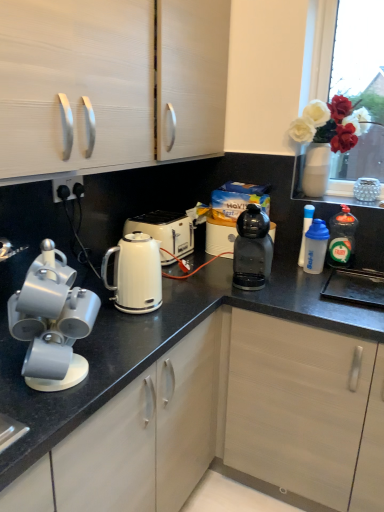
What do you see at coordinates (315, 247) in the screenshot? The height and width of the screenshot is (512, 384). I see `translucent plastic water bottle at right, which appears as the fourth kitchen appliance when viewed from the left` at bounding box center [315, 247].

The width and height of the screenshot is (384, 512). What do you see at coordinates (305, 231) in the screenshot?
I see `white plastic water bottle at right, the 3th kitchen appliance from the left` at bounding box center [305, 231].

What do you see at coordinates (66, 185) in the screenshot? The height and width of the screenshot is (512, 384). I see `black plastic socket at lower left` at bounding box center [66, 185].

Image resolution: width=384 pixels, height=512 pixels. Identify the location of white plastic toaster at upper center. (63, 192).

You are a GUI agent. You are given a task and a screenshot of the screen. Output one action in this format:
    pyautogui.click(x=<x>, y=<y>)
    Task: Click on the white glossy kettle at center
    This screenshot has width=384, height=512.
    Given the screenshot: What is the action you would take?
    pyautogui.click(x=165, y=230)

How different are the orientations of black plastic socket at lower left and translucent plastic dishwashing liquid at right, which ranks as the fifth kitchen appliance in left-to-right order, in degrees?

90 degrees.

Who is taller, black plastic socket at lower left or translucent plastic dishwashing liquid at right, which ranks as the fifth kitchen appliance in left-to-right order?

translucent plastic dishwashing liquid at right, which ranks as the fifth kitchen appliance in left-to-right order, is taller.

Is black plastic socket at lower left in contact with translucent plastic dishwashing liquid at right, the 1th kitchen appliance in the right-to-left sequence?

black plastic socket at lower left is not next to translucent plastic dishwashing liquid at right, the 1th kitchen appliance in the right-to-left sequence, and they're not touching.

Based on their positions, is black plastic socket at lower left located to the left or right of translucent plastic dishwashing liquid at right, the 1th kitchen appliance in the right-to-left sequence?

black plastic socket at lower left is positioned on translucent plastic dishwashing liquid at right, the 1th kitchen appliance in the right-to-left sequence,'s left side.

Is black plastic coffee machine at center, the second kitchen appliance viewed from the left, wider than matte gray mugs at left?

Yes, black plastic coffee machine at center, the second kitchen appliance viewed from the left, is wider than matte gray mugs at left.

Looking at this image, from a real-world perspective, between black plastic coffee machine at center, the fourth kitchen appliance when ordered from right to left, and matte gray mugs at left, who is vertically higher?

In real-world perspective, matte gray mugs at left is above.

Image resolution: width=384 pixels, height=512 pixels. In order to click on home appliance located on the left of black plastic coffee machine at center, the fourth kitchen appliance when ordered from right to left in this screenshot , I will do `click(52, 321)`.

Is black plastic coffee machine at center, the second kitchen appliance viewed from the left, in contact with matte gray mugs at left?

black plastic coffee machine at center, the second kitchen appliance viewed from the left, and matte gray mugs at left are not in contact.

Where is `the 1st kitchen appliance below when counting from the matte white cabinet at upper left (from the image's perspective)`? The height and width of the screenshot is (512, 384). the 1st kitchen appliance below when counting from the matte white cabinet at upper left (from the image's perspective) is located at coordinates (305, 231).

Considering the points (309, 208) and (52, 54), which point is in front, point (309, 208) or point (52, 54)?

Positioned in front is point (52, 54).

Can you tell me how much white plastic water bottle at right, the 3th kitchen appliance from the left, and matte white cabinet at upper left differ in facing direction?

89.5 degrees separate the facing orientations of white plastic water bottle at right, the 3th kitchen appliance from the left, and matte white cabinet at upper left.

Looking at their sizes, would you say white plastic water bottle at right, the 3th kitchen appliance from the left, is wider or thinner than matte white cabinet at upper left?

In the image, white plastic water bottle at right, the 3th kitchen appliance from the left, appears to be more narrow than matte white cabinet at upper left.

Is white plastic water bottle at right, the 3th kitchen appliance positioned from the right, shorter than white glossy electric kettle at center, marked as the fifth kitchen appliance in a right-to-left arrangement?

No, white plastic water bottle at right, the 3th kitchen appliance positioned from the right, is not shorter than white glossy electric kettle at center, marked as the fifth kitchen appliance in a right-to-left arrangement.

From a real-world perspective, count 1st kitchen appliances upward from the white glossy electric kettle at center, marked as the fifth kitchen appliance in a right-to-left arrangement, and point to it. Please provide its 2D coordinates.

[(305, 231)]

Based on the photo, between white plastic water bottle at right, the 3th kitchen appliance from the left, and white glossy electric kettle at center, marked as the fifth kitchen appliance in a right-to-left arrangement, which one appears on the left side from the viewer's perspective?

white glossy electric kettle at center, marked as the fifth kitchen appliance in a right-to-left arrangement, is more to the left.

From a real-world perspective, which is physically above, white plastic water bottle at right, the 3th kitchen appliance positioned from the right, or white glossy electric kettle at center, marked as the fifth kitchen appliance in a right-to-left arrangement?

In real-world perspective, white plastic water bottle at right, the 3th kitchen appliance positioned from the right, is above.

Who is shorter, matte white cabinet at upper left or translucent plastic dishwashing liquid at right, which ranks as the fifth kitchen appliance in left-to-right order?

translucent plastic dishwashing liquid at right, which ranks as the fifth kitchen appliance in left-to-right order.

Based on the photo, how far apart are matte white cabinet at upper left and translucent plastic dishwashing liquid at right, which ranks as the fifth kitchen appliance in left-to-right order?

matte white cabinet at upper left is 38.25 inches from translucent plastic dishwashing liquid at right, which ranks as the fifth kitchen appliance in left-to-right order.

Is the position of matte white cabinet at upper left less distant than that of translucent plastic dishwashing liquid at right, the 1th kitchen appliance in the right-to-left sequence?

Yes, it is in front of translucent plastic dishwashing liquid at right, the 1th kitchen appliance in the right-to-left sequence.

From the image's perspective, which is below, matte white cabinet at upper left or translucent plastic dishwashing liquid at right, the 1th kitchen appliance in the right-to-left sequence?

translucent plastic dishwashing liquid at right, the 1th kitchen appliance in the right-to-left sequence, from the image's perspective.

What's the angular difference between matte white cabinet at upper left and white glossy kettle at center's facing directions?

matte white cabinet at upper left and white glossy kettle at center are facing 1.35 degrees away from each other.

The width and height of the screenshot is (384, 512). In order to click on cabinetry that appears on the left of white glossy kettle at center in this screenshot , I will do `click(110, 85)`.

Is white glossy kettle at center located within matte white cabinet at upper left?

No, matte white cabinet at upper left does not contain white glossy kettle at center.

Considering the relative sizes of white plastic toaster at upper center and black plastic coffee machine at center in the image provided, is white plastic toaster at upper center thinner than black plastic coffee machine at center?

Yes, white plastic toaster at upper center is thinner than black plastic coffee machine at center.

Is white plastic toaster at upper center at the left side of black plastic coffee machine at center?

Yes, white plastic toaster at upper center is to the left of black plastic coffee machine at center.

How different are the orientations of white plastic toaster at upper center and black plastic coffee machine at center in degrees?

They differ by 87.1 degrees in their facing directions.

Is white plastic toaster at upper center not close to black plastic coffee machine at center?

No, white plastic toaster at upper center is not far away from black plastic coffee machine at center.

Identify the location of electric outlet on the left side of translucent plastic dishwashing liquid at right, the 1th kitchen appliance in the right-to-left sequence. The image size is (384, 512). (66, 185).

Identify the location of home appliance located above the black plastic coffee machine at center, the fourth kitchen appliance when ordered from right to left (from a real-world perspective). This screenshot has width=384, height=512. (52, 321).

Estimate the real-world distances between objects in this image. Which object is further from black plastic socket at lower left, matte gray mugs at left or white glossy kettle at center?

Based on the image, matte gray mugs at left appears to be further to black plastic socket at lower left.

Looking at the image, which one is located further to translucent plastic dishwashing liquid at right, which ranks as the fifth kitchen appliance in left-to-right order, black plastic coffee machine at center, the second kitchen appliance viewed from the left, or white plastic toaster at upper center?

white plastic toaster at upper center is positioned further to the anchor translucent plastic dishwashing liquid at right, which ranks as the fifth kitchen appliance in left-to-right order.

Estimate the real-world distances between objects in this image. Which object is closer to black plastic coffee machine at center, translucent plastic water bottle at right, which appears as the fourth kitchen appliance when viewed from the left, or translucent plastic dishwashing liquid at right, the 1th kitchen appliance in the right-to-left sequence?

translucent plastic water bottle at right, which appears as the fourth kitchen appliance when viewed from the left.

Looking at the image, which one is located closer to black plastic coffee machine at center, white glossy electric kettle at center, the first kitchen appliance viewed from the left, or translucent plastic dishwashing liquid at right, which ranks as the fifth kitchen appliance in left-to-right order?

Among the two, translucent plastic dishwashing liquid at right, which ranks as the fifth kitchen appliance in left-to-right order, is located nearer to black plastic coffee machine at center.

Looking at the image, which one is located further to black plastic coffee machine at center, the second kitchen appliance viewed from the left, white glossy electric kettle at center, the first kitchen appliance viewed from the left, or matte gray mugs at left?

Among the two, matte gray mugs at left is located further to black plastic coffee machine at center, the second kitchen appliance viewed from the left.

From the image, which object appears to be nearer to translucent plastic dishwashing liquid at right, the 1th kitchen appliance in the right-to-left sequence, white glossy kettle at center or translucent plastic water bottle at right, which appears as the fourth kitchen appliance when viewed from the left?

The object closer to translucent plastic dishwashing liquid at right, the 1th kitchen appliance in the right-to-left sequence, is translucent plastic water bottle at right, which appears as the fourth kitchen appliance when viewed from the left.

When comparing their distances from white glossy kettle at center, does matte white cabinet at upper left or white glossy electric kettle at center, marked as the fifth kitchen appliance in a right-to-left arrangement, seem further?

matte white cabinet at upper left.

When comparing their distances from matte white cabinet at upper left, does black plastic socket at lower left or black plastic coffee machine at center seem closer?

black plastic socket at lower left lies closer to matte white cabinet at upper left than the other object.

Locate an element on the screen. kettle positioned between matte gray mugs at left and black plastic coffee machine at center from near to far is located at coordinates (165, 230).

Where is `electric outlet situated between white plastic toaster at upper center and translucent plastic water bottle at right, which appears as the fourth kitchen appliance when viewed from the left, from left to right`? Image resolution: width=384 pixels, height=512 pixels. electric outlet situated between white plastic toaster at upper center and translucent plastic water bottle at right, which appears as the fourth kitchen appliance when viewed from the left, from left to right is located at coordinates (66, 185).

The image size is (384, 512). What are the coordinates of `kettle between black plastic socket at lower left and black plastic coffee machine at center in the horizontal direction` in the screenshot? It's located at (165, 230).

Locate an element on the screen. kettle located between black plastic socket at lower left and translucent plastic dishwashing liquid at right, the 1th kitchen appliance in the right-to-left sequence, in the left-right direction is located at coordinates (165, 230).